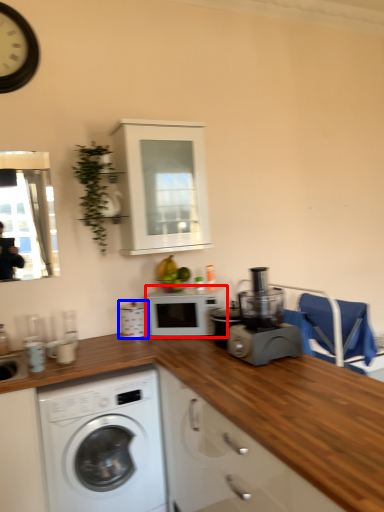
Question: Which object is closer to the camera taking this photo, microwave oven (highlighted by a red box) or appliance (highlighted by a blue box)?

Choices:
 (A) microwave oven
 (B) appliance

Answer: (A)